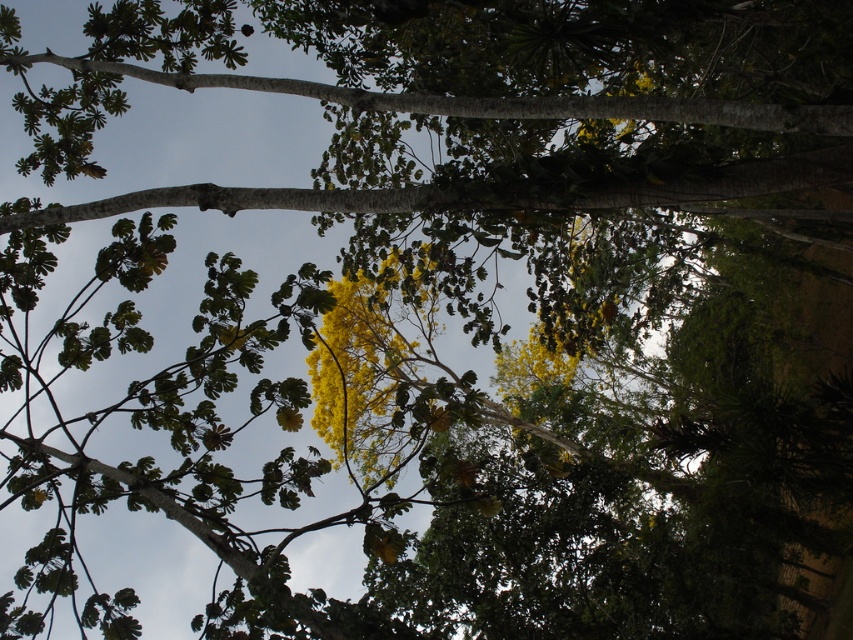
Is green leafy branch at upper center taller than smooth bark branch at upper center?

Yes, green leafy branch at upper center is taller than smooth bark branch at upper center.

Can you confirm if green leafy branch at upper center is thinner than smooth bark branch at upper center?

In fact, green leafy branch at upper center might be wider than smooth bark branch at upper center.

Measure the distance between point (548, 205) and camera.

Point (548, 205) is 4.84 meters from camera.

Find the location of a particular element. Image resolution: width=853 pixels, height=640 pixels. green leafy branch at upper center is located at coordinates (474, 193).